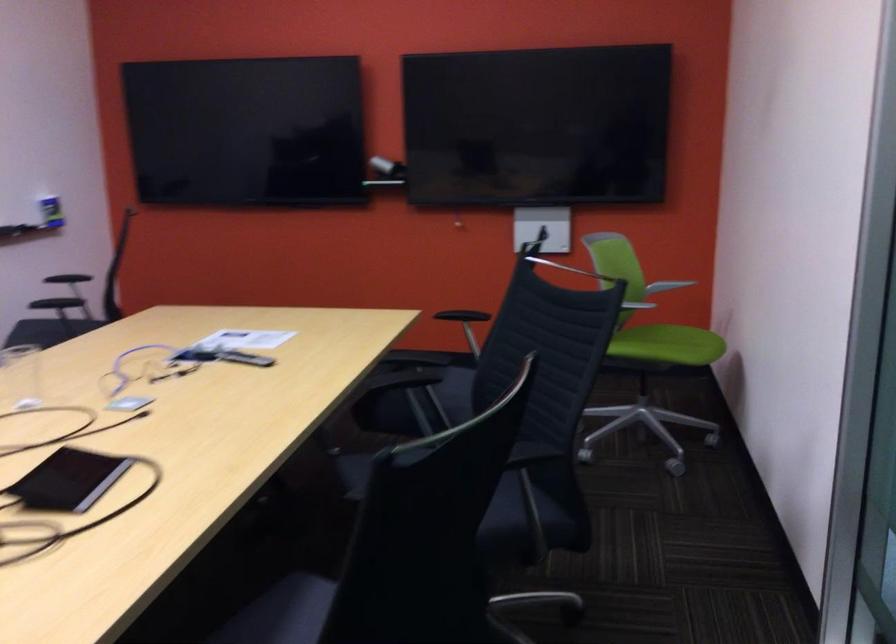
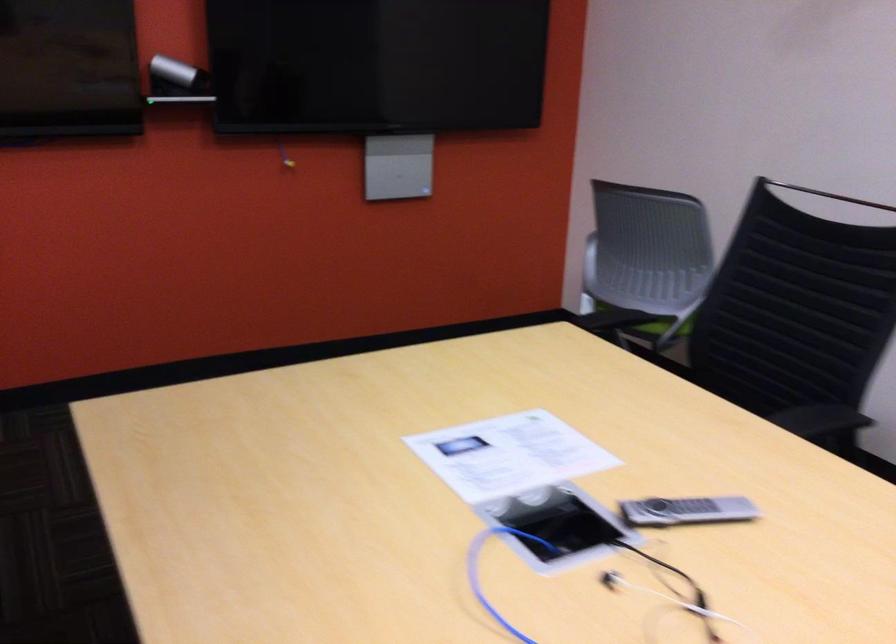
Question: I am providing you with two images of the same scene from different viewpoints. After the viewpoint changes to image2, which objects are now occluded?

Choices:
 (A) green chair sitting surface
 (B) white earbuds
 (C) grey remote control
 (D) pink drawer pull

Answer: (A)